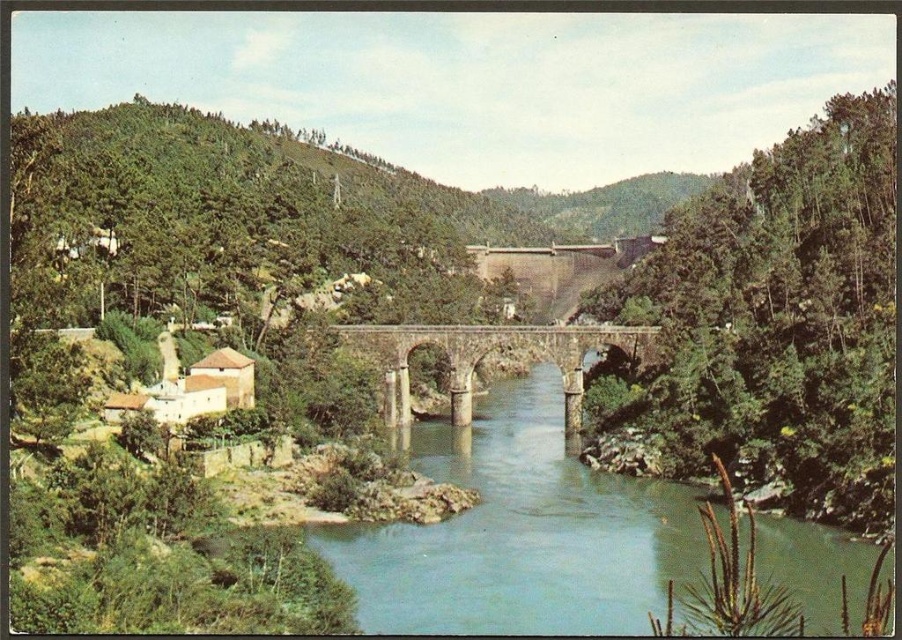
You are an engineer assessing the feasibility of a new pedestrian path. You need to determine if the stone arch bridge at center can support a walkway that is 10 meters wide. Given the current width of the green stone river at center, what is your recommendation?

The green stone river at center is wider than the stone arch bridge at center. Since the river is wider, the bridge must be at least as wide as the river to span it. However, the bridge is narrower than the river, so constructing a 10m wide walkway on the bridge may compromise its structural integrity. Recommend against it unless structural reinforcements are added.

You are standing at the origin point of the coordinate system in the scene. The green stone river at center is located at coordinates. What are its coordinates?

The green stone river at center is located at coordinates point (520,532).

You are standing at the stone bridge and want to reach the dam. There are two points marked on the image, point A at coordinates point (486, 584) and point B at coordinates point (384, 387). Which point should you head towards to get closer to the dam?

Point A at coordinates point (486, 584) is closer to the viewer than point B at coordinates point (384, 387). Therefore, heading towards point A would bring you closer to the dam.